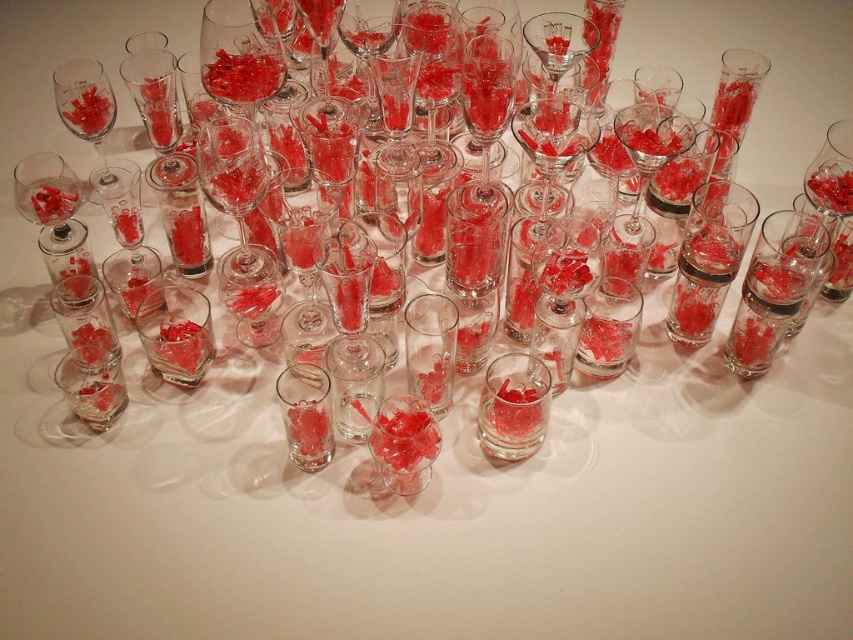
In the scene shown: Is transparent glass at right positioned before matte glass wine glass at upper left?

That is True.

Does transparent glass at right appear on the left side of matte glass wine glass at upper left?

Incorrect, transparent glass at right is not on the left side of matte glass wine glass at upper left.

In the scene shown: Measure the distance between point (767, 310) and camera.

A distance of 1.14 meters exists between point (767, 310) and camera.

You are a GUI agent. You are given a task and a screenshot of the screen. Output one action in this format:
    pyautogui.click(x=<x>, y=<y>)
    Task: Click on the transparent glass at right
    The width and height of the screenshot is (853, 640).
    Given the screenshot: What is the action you would take?
    point(775,288)

Can you confirm if transparent glass at right is positioned below transparent glass at center?

No, transparent glass at right is not below transparent glass at center.

Which of these two, transparent glass at right or transparent glass at center, stands taller?

With more height is transparent glass at right.

Describe the element at coordinates (775, 288) in the screenshot. I see `transparent glass at right` at that location.

Locate an element on the screen. transparent glass at right is located at coordinates (775, 288).

Does transparent glass at center have a smaller size compared to matte glass wine glass at upper left?

Correct, transparent glass at center occupies less space than matte glass wine glass at upper left.

Locate an element on the screen. This screenshot has height=640, width=853. transparent glass at center is located at coordinates (430, 349).